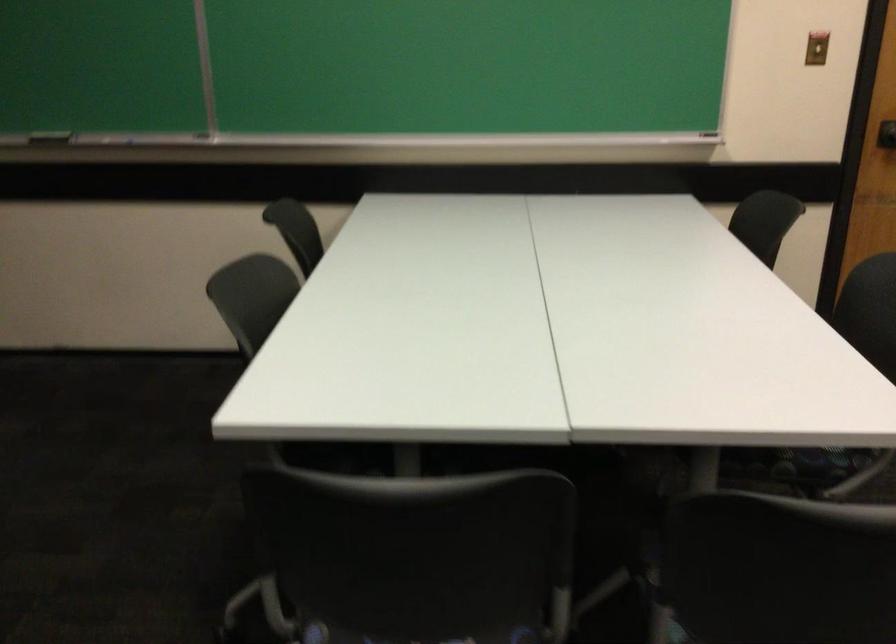
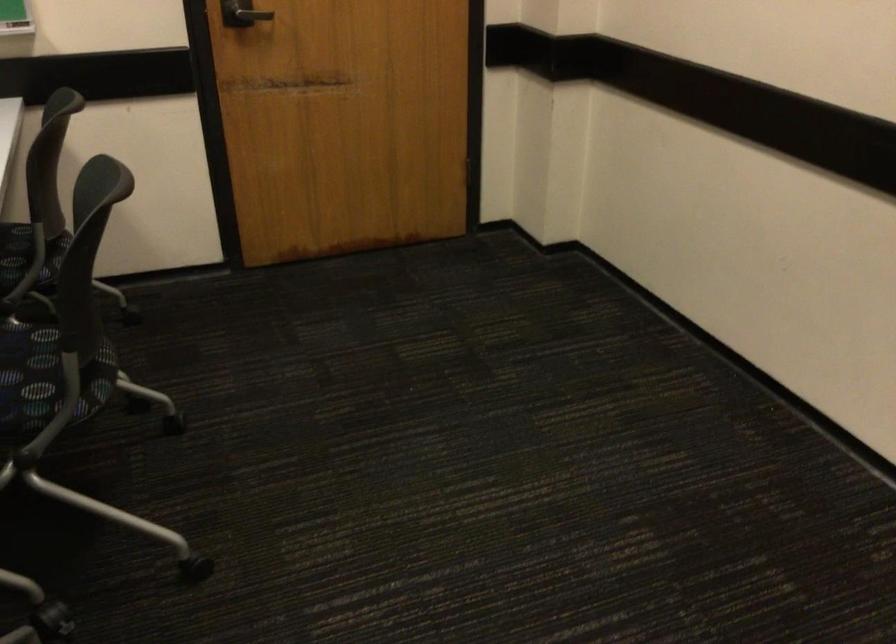
Question: The first image is from the beginning of the video and the second image is from the end. How did the camera likely rotate when shooting the video?

Choices:
 (A) Left
 (B) Right
 (C) Up
 (D) Down

Answer: (B)